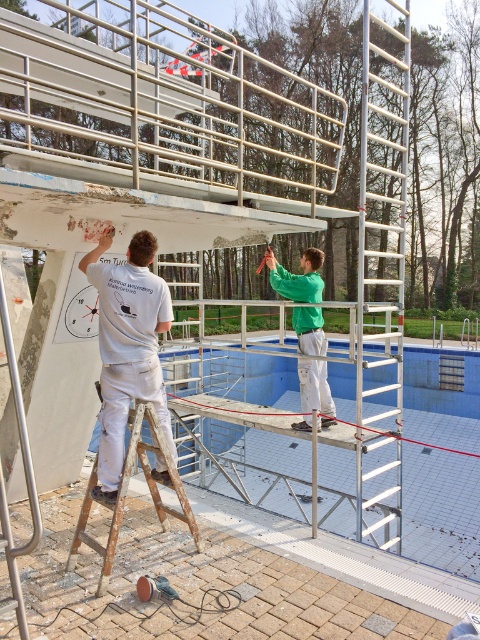
You are a contractor assessing the poolside area. You need to place a safety net between the blue tile swimming pool at center and the silver metallic ladder at upper center. Based on their positions, which side of the ladder should the net be placed on to ensure it stays between them?

The blue tile swimming pool at center is to the left of the silver metallic ladder at upper center. Therefore, the safety net should be placed to the left side of the ladder to stay between them.

What is the location of the point with coordinates (441, 509) in the image?

The point with coordinates (441, 509) corresponds to the blue tile swimming pool at center.